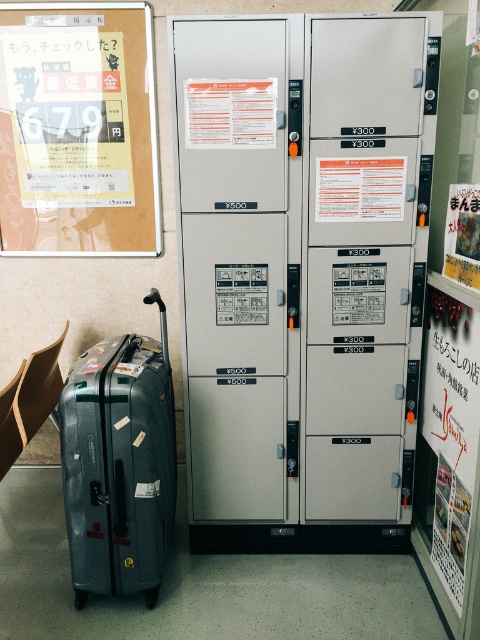
Question: Observing the image, what is the correct spatial positioning of white paper poster at center in reference to white glossy poster at center?

Choices:
 (A) below
 (B) above

Answer: (B)

Question: Which of the following is the farthest from the observer?

Choices:
 (A) (459, 202)
 (B) (232, 81)
 (C) (335, 164)
 (D) (85, 68)

Answer: (D)

Question: Is matte cardboard poster at upper left below white paper poster at center?

Choices:
 (A) no
 (B) yes

Answer: (A)

Question: In this image, where is matte cardboard poster at upper left located relative to white paper poster at center?

Choices:
 (A) below
 (B) above

Answer: (B)

Question: Which object is the closest to the white glossy poster at center?

Choices:
 (A) white paper poster at center
 (B) matte plastic poster at center
 (C) matte paper poster at right

Answer: (A)

Question: Among these objects, which one is nearest to the camera?

Choices:
 (A) white glossy poster at center
 (B) shiny metallic suitcase at lower left

Answer: (B)